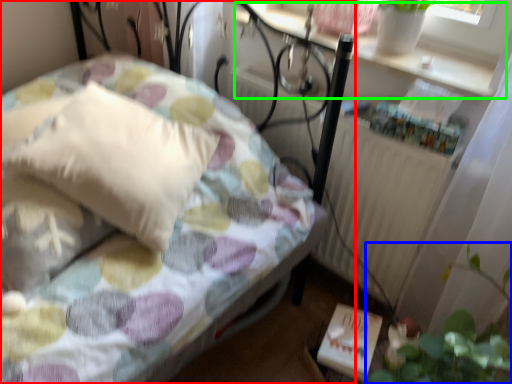
Question: Which is nearer to the bed (highlighted by a red box)? plant (highlighted by a blue box) or window sill (highlighted by a green box).

Choices:
 (A) plant
 (B) window sill

Answer: (B)